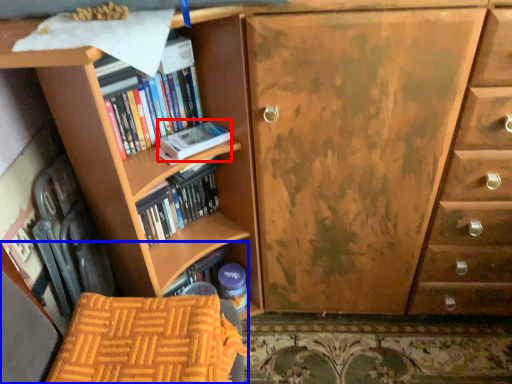
Question: Which of the following is the farthest to the observer, paperback book (highlighted by a red box) or armchair (highlighted by a blue box)?

Choices:
 (A) paperback book
 (B) armchair

Answer: (A)